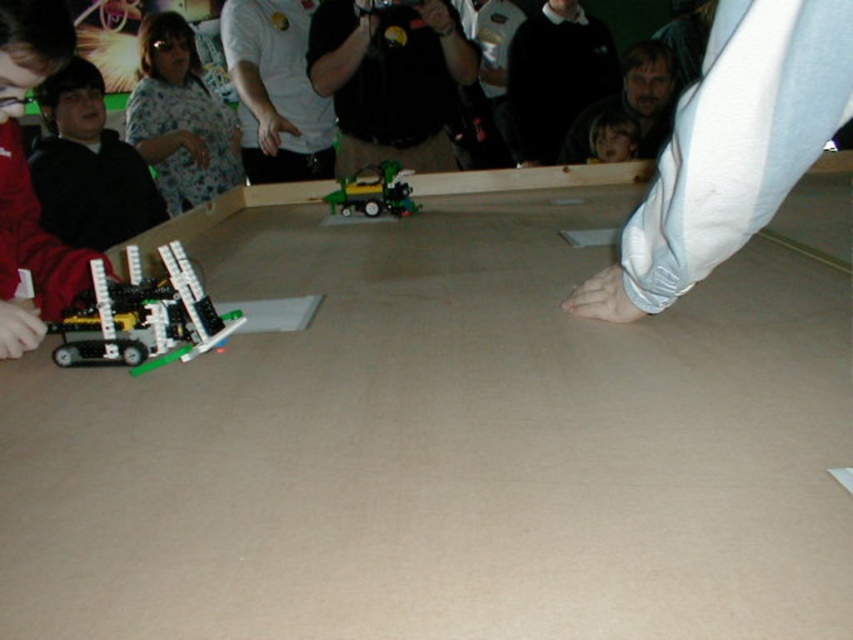
Is floral shirt at upper left to the left of green plastic toy car at center from the viewer's perspective?

Indeed, floral shirt at upper left is positioned on the left side of green plastic toy car at center.

Which of these two, floral shirt at upper left or green plastic toy car at center, stands shorter?

Standing shorter between the two is green plastic toy car at center.

Who is more distant from viewer, (225, 116) or (358, 173)?

Point (225, 116)

Where is `floral shirt at upper left`? The width and height of the screenshot is (853, 640). floral shirt at upper left is located at coordinates (180, 118).

Based on the photo, between black plastic camera at center and translucent plastic robot at lower left, which one appears on the left side from the viewer's perspective?

translucent plastic robot at lower left

Locate an element on the screen. black plastic camera at center is located at coordinates (392, 81).

Find the location of a particular element. This screenshot has height=640, width=853. black plastic camera at center is located at coordinates (392, 81).

Does translucent plastic robot at lower left appear on the left side of green plastic toy car at center?

Yes, translucent plastic robot at lower left is to the left of green plastic toy car at center.

Which is behind, point (115, 326) or point (375, 193)?

Positioned behind is point (375, 193).

Is point (57, 352) closer to camera compared to point (347, 177)?

That is True.

In order to click on translucent plastic robot at lower left in this screenshot , I will do `click(142, 317)`.